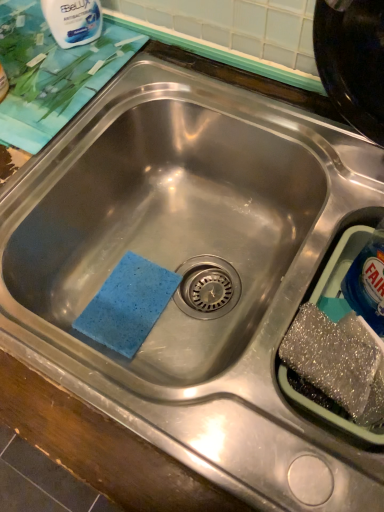
Question: Based on their positions, is blue plastic bottle at right located to the left or right of white glossy bottle at upper left?

Choices:
 (A) right
 (B) left

Answer: (A)

Question: Is blue plastic bottle at right spatially inside white glossy bottle at upper left, or outside of it?

Choices:
 (A) outside
 (B) inside

Answer: (A)

Question: Is point (382, 250) closer or farther from the camera than point (51, 18)?

Choices:
 (A) closer
 (B) farther

Answer: (A)

Question: Is white glossy bottle at upper left bigger or smaller than blue plastic bottle at right?

Choices:
 (A) small
 (B) big

Answer: (A)

Question: Is point (79, 40) positioned closer to the camera than point (382, 311)?

Choices:
 (A) farther
 (B) closer

Answer: (A)

Question: From their relative heights in the image, would you say white glossy bottle at upper left is taller or shorter than blue plastic bottle at right?

Choices:
 (A) tall
 (B) short

Answer: (B)

Question: Is white glossy bottle at upper left in front of or behind blue plastic bottle at right in the image?

Choices:
 (A) front
 (B) behind

Answer: (B)